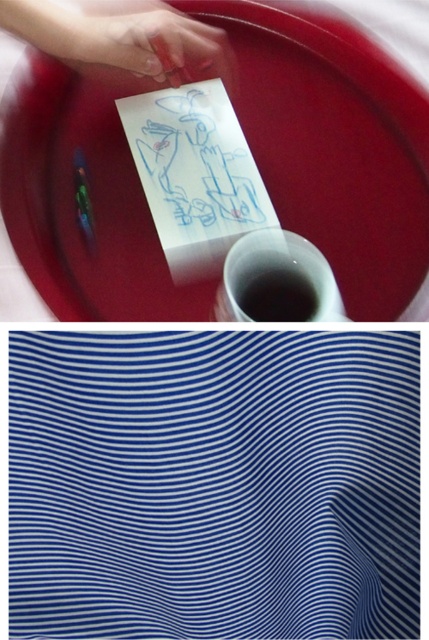
Question: Observing the image, what is the correct spatial positioning of smooth skin hand at upper left in reference to black matte liquid at center?

Choices:
 (A) right
 (B) left

Answer: (B)

Question: Which point is closer to the camera taking this photo?

Choices:
 (A) (287, 280)
 (B) (214, 49)

Answer: (A)

Question: Is smooth skin hand at upper left bigger than black matte liquid at center?

Choices:
 (A) yes
 (B) no

Answer: (A)

Question: Can you confirm if smooth skin hand at upper left is positioned to the left of black matte liquid at center?

Choices:
 (A) no
 (B) yes

Answer: (B)